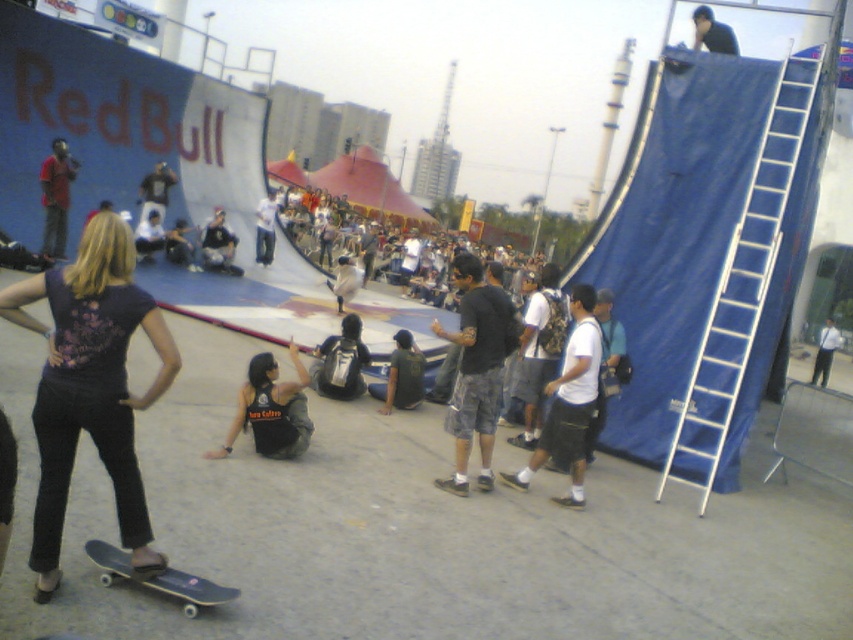
Which of these two, dark blue jeans at center or white shirt at right, stands taller?

Standing taller between the two is white shirt at right.

Which is in front, point (212, 240) or point (825, 380)?

Point (212, 240) is more forward.

Is point (229, 246) positioned before point (817, 339)?

Yes, it is.

Locate an element on the screen. The height and width of the screenshot is (640, 853). dark blue jeans at center is located at coordinates (218, 241).

Can you confirm if dark blue jeans at center is shorter than light blue jeans at center?

Yes.

Does dark blue jeans at center appear on the left side of light blue jeans at center?

Correct, you'll find dark blue jeans at center to the left of light blue jeans at center.

Who is more forward, [202,243] or [268,205]?

Positioned in front is point [202,243].

At what (x,y) coordinates should I click in order to perform the action: click on dark blue jeans at center. Please return your answer as a coordinate pair (x, y). Looking at the image, I should click on (218, 241).

Who is lower down, dark purple shirt at center or matte black shirt at upper left?

Positioned lower is dark purple shirt at center.

Who is more distant from viewer, [149,536] or [45,188]?

Positioned behind is point [45,188].

Which is in front, point (155, 380) or point (49, 176)?

Point (155, 380) is more forward.

The height and width of the screenshot is (640, 853). I want to click on dark purple shirt at center, so click(90, 387).